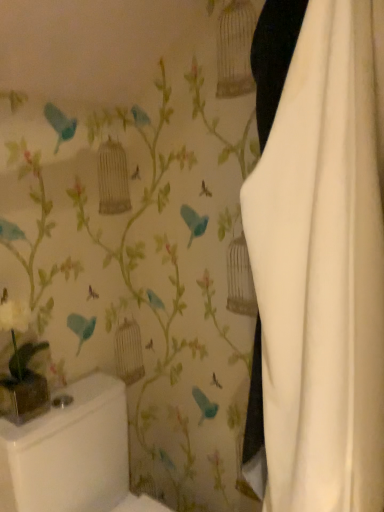
The height and width of the screenshot is (512, 384). In order to click on white fabric curtain at right in this screenshot , I will do (x=318, y=257).

The width and height of the screenshot is (384, 512). Describe the element at coordinates (318, 257) in the screenshot. I see `white fabric curtain at right` at that location.

Where is `white glossy toilet bowl at lower left`? The width and height of the screenshot is (384, 512). white glossy toilet bowl at lower left is located at coordinates (72, 455).

What do you see at coordinates (72, 455) in the screenshot? I see `white glossy toilet bowl at lower left` at bounding box center [72, 455].

What is the approximate width of white glossy toilet bowl at lower left?

It is 24.84 inches.

The height and width of the screenshot is (512, 384). Find the location of `white fabric curtain at right`. white fabric curtain at right is located at coordinates (318, 257).

Looking at this image, is white glossy toilet bowl at lower left to the left or to the right of white fabric curtain at right in the image?

In the image, white glossy toilet bowl at lower left appears on the left side of white fabric curtain at right.

Considering the positions of objects white glossy toilet bowl at lower left and white fabric curtain at right in the image provided, who is behind, white glossy toilet bowl at lower left or white fabric curtain at right?

Positioned behind is white glossy toilet bowl at lower left.

Is point (35, 484) in front of point (319, 149)?

No.

From the image's perspective, is white glossy toilet bowl at lower left over white fabric curtain at right?

No, from the image's perspective, white glossy toilet bowl at lower left is not on top of white fabric curtain at right.

From a real-world perspective, is white glossy toilet bowl at lower left physically located above or below white fabric curtain at right?

In terms of real-world spatial position, white glossy toilet bowl at lower left is below white fabric curtain at right.

Which of these two, white glossy toilet bowl at lower left or white fabric curtain at right, is wider?

With larger width is white glossy toilet bowl at lower left.

Is white glossy toilet bowl at lower left shorter than white fabric curtain at right?

Correct, white glossy toilet bowl at lower left is not as tall as white fabric curtain at right.

Based on the photo, can you confirm if white glossy toilet bowl at lower left is smaller than white fabric curtain at right?

No, white glossy toilet bowl at lower left is not smaller than white fabric curtain at right.

Would you say white glossy toilet bowl at lower left is inside or outside white fabric curtain at right?

white glossy toilet bowl at lower left is not enclosed by white fabric curtain at right.

Is white glossy toilet bowl at lower left positioned far away from white fabric curtain at right?

white glossy toilet bowl at lower left is near white fabric curtain at right, not far away.

Is white glossy toilet bowl at lower left turned away from white fabric curtain at right?

That's not correct — white glossy toilet bowl at lower left is not looking away from white fabric curtain at right.

Can you tell me how much white glossy toilet bowl at lower left and white fabric curtain at right differ in facing direction?

11.7 degrees.

Image resolution: width=384 pixels, height=512 pixels. What are the coordinates of `toilet bowl below the white fabric curtain at right (from a real-world perspective)` in the screenshot? It's located at (72, 455).

In the scene shown: Which is more to the right, white fabric curtain at right or white glossy toilet bowl at lower left?

white fabric curtain at right.

Between white fabric curtain at right and white glossy toilet bowl at lower left, which one is positioned in front?

Positioned in front is white fabric curtain at right.

Is point (364, 137) less distant than point (112, 490)?

Yes.

From the image's perspective, is white fabric curtain at right on top of white glossy toilet bowl at lower left?

Yes.

Based on the photo, from a real-world perspective, which is physically below, white fabric curtain at right or white glossy toilet bowl at lower left?

white glossy toilet bowl at lower left is physically lower.

Consider the image. Considering the sizes of objects white fabric curtain at right and white glossy toilet bowl at lower left in the image provided, who is wider, white fabric curtain at right or white glossy toilet bowl at lower left?

white glossy toilet bowl at lower left.

From their relative heights in the image, would you say white fabric curtain at right is taller or shorter than white glossy toilet bowl at lower left?

Clearly, white fabric curtain at right is taller compared to white glossy toilet bowl at lower left.

Consider the image. Which of these two, white fabric curtain at right or white glossy toilet bowl at lower left, is smaller?

white fabric curtain at right.

Can we say white fabric curtain at right lies outside white glossy toilet bowl at lower left?

Yes, white fabric curtain at right is located beyond the bounds of white glossy toilet bowl at lower left.

Is white fabric curtain at right beside white glossy toilet bowl at lower left?

No, white fabric curtain at right is not beside white glossy toilet bowl at lower left.

Is white fabric curtain at right turned away from white glossy toilet bowl at lower left?

Yes, white fabric curtain at right is facing away from white glossy toilet bowl at lower left.

At what (x,y) coordinates should I click in order to perform the action: click on curtain in front of the white glossy toilet bowl at lower left. Please return your answer as a coordinate pair (x, y). The height and width of the screenshot is (512, 384). Looking at the image, I should click on (318, 257).

Locate an element on the screen. toilet bowl located underneath the white fabric curtain at right (from a real-world perspective) is located at coordinates (72, 455).

Find the location of a particular element. curtain that is in front of the white glossy toilet bowl at lower left is located at coordinates (318, 257).